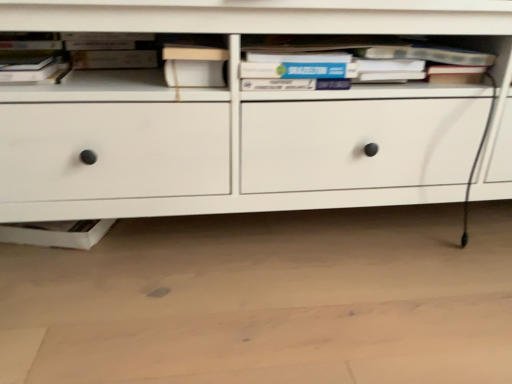
Question: From the image's perspective, is hardcover book at upper left, which is the first book in left-to-right order, located above white matte chest of drawers at center?

Choices:
 (A) yes
 (B) no

Answer: (A)

Question: Can you confirm if hardcover book at upper left, the 2th book in the right-to-left sequence, is taller than white matte chest of drawers at center?

Choices:
 (A) yes
 (B) no

Answer: (B)

Question: Could you tell me if hardcover book at upper left, which is the first book in left-to-right order, is facing white matte chest of drawers at center?

Choices:
 (A) yes
 (B) no

Answer: (A)

Question: Does hardcover book at upper left, which is the first book in left-to-right order, have a greater width compared to white matte chest of drawers at center?

Choices:
 (A) no
 (B) yes

Answer: (A)

Question: Is hardcover book at upper left, the 2th book in the right-to-left sequence, to the left of white matte chest of drawers at center from the viewer's perspective?

Choices:
 (A) yes
 (B) no

Answer: (A)

Question: Considering the positions of hardcover book at center, marked as the 2th book in a left-to-right arrangement, and white matte chest of drawers at center in the image, is hardcover book at center, marked as the 2th book in a left-to-right arrangement, taller or shorter than white matte chest of drawers at center?

Choices:
 (A) tall
 (B) short

Answer: (B)

Question: Considering their positions, is hardcover book at center, which ranks as the 1th book in right-to-left order, located in front of or behind white matte chest of drawers at center?

Choices:
 (A) front
 (B) behind

Answer: (B)

Question: From the image's perspective, is hardcover book at center, which ranks as the 1th book in right-to-left order, positioned above or below white matte chest of drawers at center?

Choices:
 (A) below
 (B) above

Answer: (B)

Question: Visually, is hardcover book at center, which ranks as the 1th book in right-to-left order, positioned to the left or to the right of white matte chest of drawers at center?

Choices:
 (A) left
 (B) right

Answer: (B)

Question: Is hardcover book at upper left, the 2th book in the right-to-left sequence, inside or outside of hardcover book at center, marked as the 2th book in a left-to-right arrangement?

Choices:
 (A) outside
 (B) inside

Answer: (A)

Question: Considering the positions of point tap(0, 54) and point tap(329, 62), is point tap(0, 54) closer or farther from the camera than point tap(329, 62)?

Choices:
 (A) farther
 (B) closer

Answer: (A)

Question: Based on their sizes in the image, would you say hardcover book at upper left, which is the first book in left-to-right order, is bigger or smaller than hardcover book at center, marked as the 2th book in a left-to-right arrangement?

Choices:
 (A) small
 (B) big

Answer: (A)

Question: Considering the positions of hardcover book at upper left, which is the first book in left-to-right order, and hardcover book at center, which ranks as the 1th book in right-to-left order, in the image, is hardcover book at upper left, which is the first book in left-to-right order, wider or thinner than hardcover book at center, which ranks as the 1th book in right-to-left order,?

Choices:
 (A) thin
 (B) wide

Answer: (A)

Question: In the image, is white matte chest of drawers at center on the left side or the right side of hardcover book at upper left, which is the first book in left-to-right order?

Choices:
 (A) right
 (B) left

Answer: (A)

Question: From a real-world perspective, is white matte chest of drawers at center positioned above or below hardcover book at upper left, which is the first book in left-to-right order?

Choices:
 (A) below
 (B) above

Answer: (A)